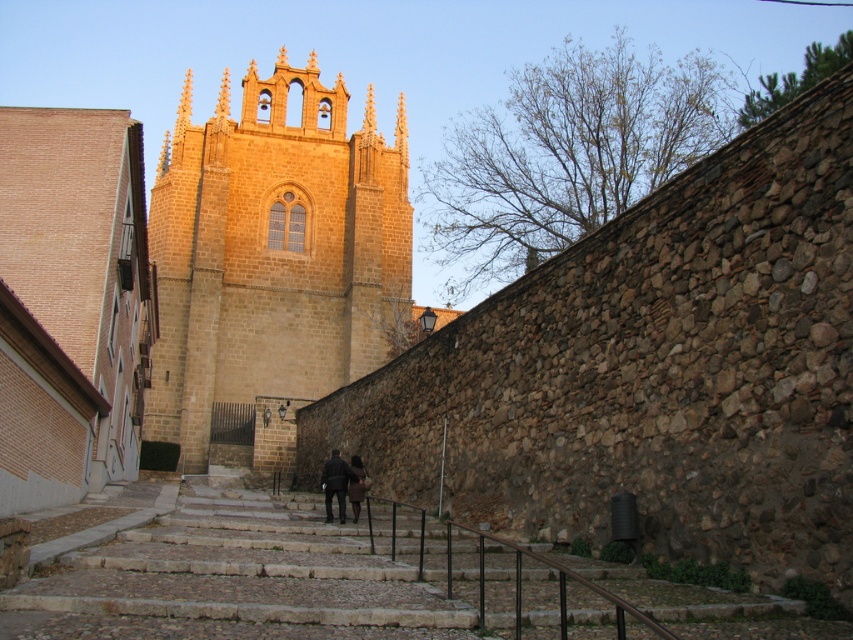
You are a tourist standing at the base of the golden stone tower at center and want to take a photo of yourself with the tower in the background. However, there is a dark brown leather jacket at center in the way. Can you still take the photo with the tower visible behind the jacket?

The golden stone tower at center is taller than the dark brown leather jacket at center, so yes, you can take the photo with the tower visible behind the jacket since it extends above the jacket.